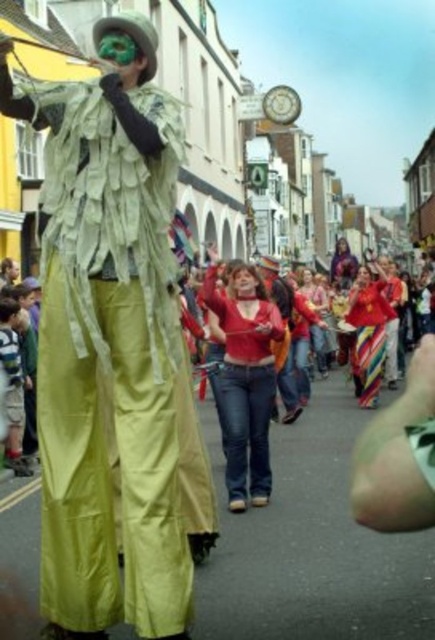
Is point (82, 204) farther from viewer compared to point (378, 388)?

No, (82, 204) is in front of (378, 388).

Which is more to the left, green fabric costume at center or multicolored striped pants at center?

green fabric costume at center

The image size is (435, 640). I want to click on green fabric costume at center, so click(110, 353).

The width and height of the screenshot is (435, 640). Identify the location of green fabric costume at center. (110, 353).

Is green fabric costume at center thinner than matte red sweater at center?

In fact, green fabric costume at center might be wider than matte red sweater at center.

Is point (159, 493) closer to viewer compared to point (258, 444)?

Yes, it is in front of point (258, 444).

Does point (90, 172) lie behind point (231, 493)?

No, it is not.

Locate an element on the screen. This screenshot has width=435, height=640. green fabric costume at center is located at coordinates [x=110, y=353].

Who is positioned more to the left, multicolored striped pants at center or smooth skin face at center?

smooth skin face at center

Does multicolored striped pants at center come in front of smooth skin face at center?

No, multicolored striped pants at center is behind smooth skin face at center.

I want to click on multicolored striped pants at center, so click(x=368, y=333).

Image resolution: width=435 pixels, height=640 pixels. I want to click on multicolored striped pants at center, so click(368, 333).